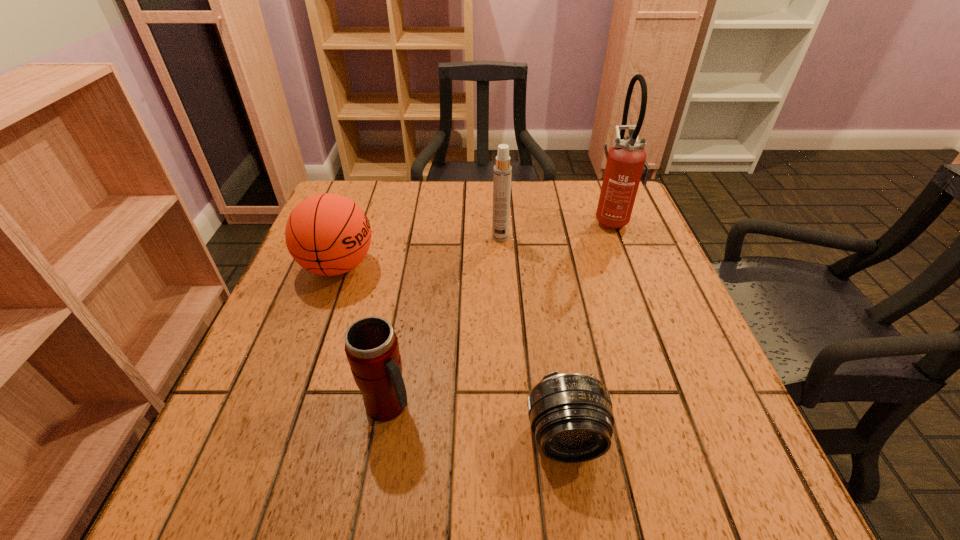
In the image, there is a desktop. At what (x,y) coordinates should I click in order to perform the action: click on vacant space at the near edge. Please return your answer as a coordinate pair (x, y). Looking at the image, I should click on (622, 460).

This screenshot has height=540, width=960. Identify the location of vacant space at the left edge of the desktop. point(349,279).

Identify the location of vacant space at the right edge. This screenshot has width=960, height=540. (654, 415).

Find the location of `blank space at the far left corner`. blank space at the far left corner is located at coordinates (371, 190).

In order to click on empty location between the aerosol can and the rightmost object in this screenshot , I will do `click(557, 228)`.

Find the location of a particular element. This screenshot has width=960, height=540. blank region between the shortest object and the third object from left to right is located at coordinates (533, 337).

Find the location of `empty space that is in between the basketball and the third object from right to left`. empty space that is in between the basketball and the third object from right to left is located at coordinates (420, 252).

Find the location of a particular element. This screenshot has height=540, width=960. free point between the fourth shortest object and the tallest object is located at coordinates (557, 228).

Image resolution: width=960 pixels, height=540 pixels. I want to click on vacant space in between the third object from left to right and the basketball, so click(420, 252).

Locate an element on the screen. The width and height of the screenshot is (960, 540). vacant point located between the fourth object from left to right and the fire extinguisher is located at coordinates (589, 328).